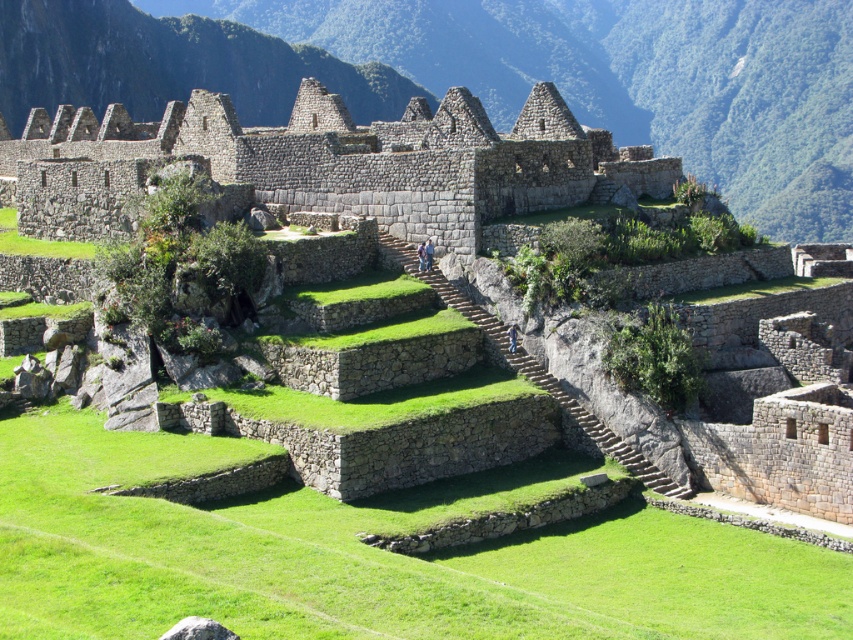
Does natural stone ruins at center have a lesser height compared to gray stone ruins at center?

No.

Which is behind, point (90, 90) or point (445, 224)?

The point (90, 90) is more distant.

Identify the location of natural stone ruins at center. (491, 74).